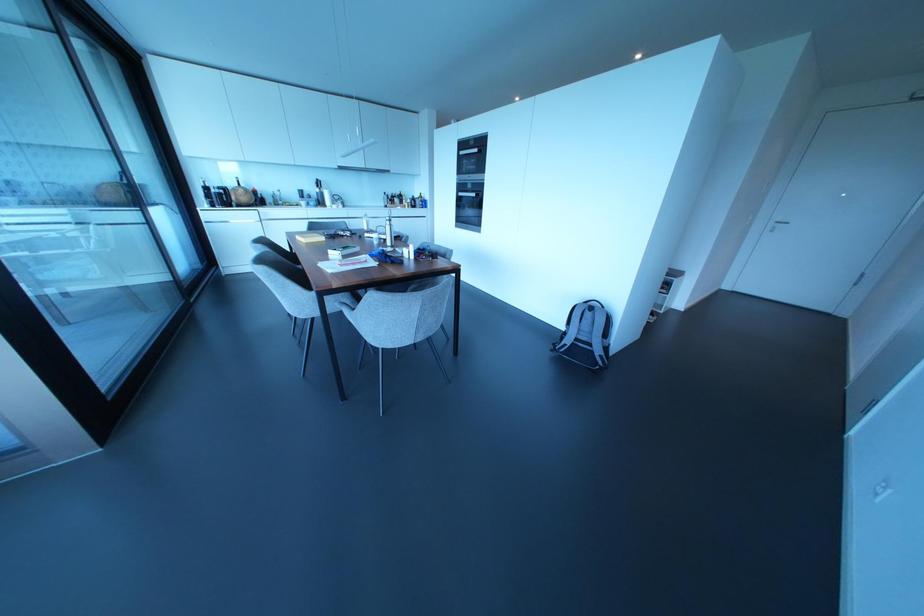
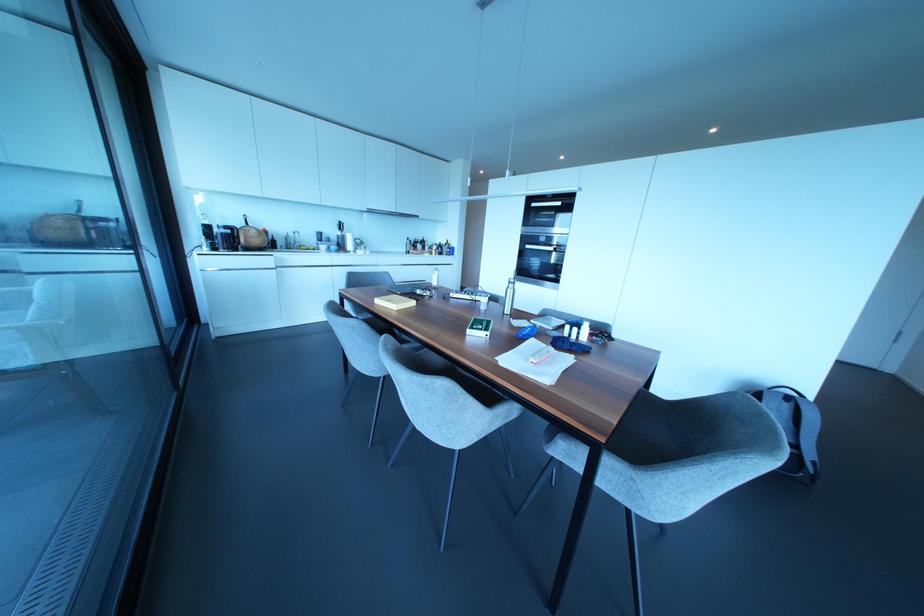
Find the pixel in the second image that matches pixel 330 252 in the first image.

(468, 331)